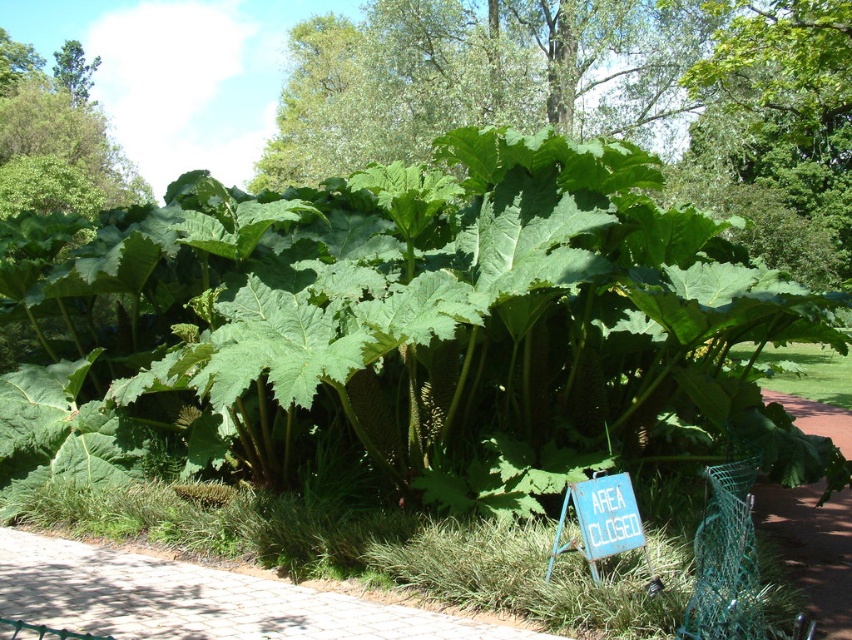
Which is more to the right, green leafy plant at center or cobblestone path at lower left?

green leafy plant at center

Which is in front, point (743, 195) or point (297, 621)?

Point (297, 621) is in front.

Does point (816, 246) come behind point (84, 563)?

Yes, it is.

Identify the location of green leafy plant at center. (597, 99).